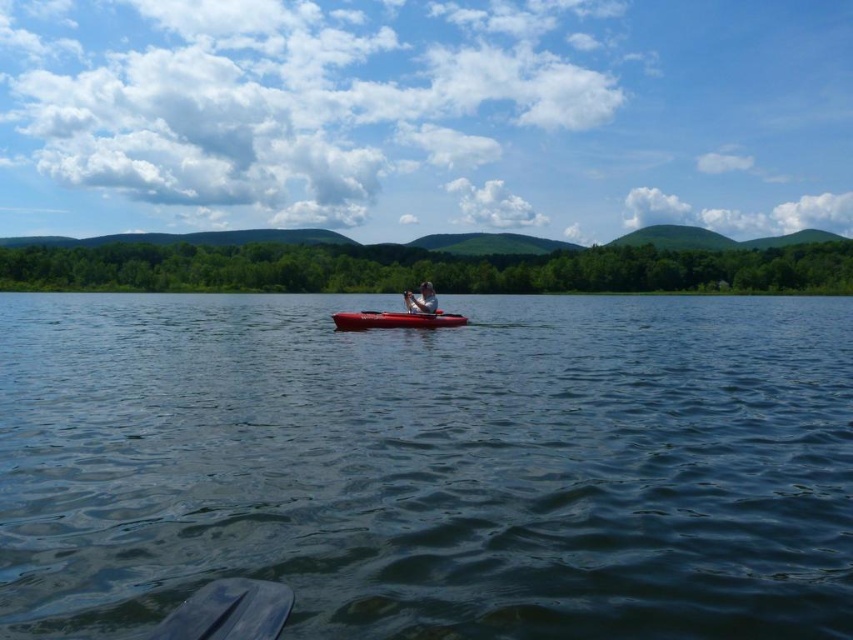
Question: Can you confirm if dark blue water at center is positioned to the right of matte gray kayak at center?

Choices:
 (A) yes
 (B) no

Answer: (B)

Question: From the image, what is the correct spatial relationship of matte red canoe at center in relation to matte gray kayak at center?

Choices:
 (A) below
 (B) above

Answer: (A)

Question: Which of the following is the closest to the observer?

Choices:
 (A) tap(366, 317)
 (B) tap(47, 346)
 (C) tap(447, 324)

Answer: (B)

Question: Which object is farther from the camera taking this photo?

Choices:
 (A) matte red canoe at center
 (B) dark blue water at center
 (C) black plastic paddle at center

Answer: (A)

Question: Estimate the real-world distances between objects in this image. Which object is closer to the dark blue water at center?

Choices:
 (A) matte red canoe at center
 (B) black plastic paddle at center

Answer: (B)

Question: Is dark blue water at center above black plastic paddle at center?

Choices:
 (A) yes
 (B) no

Answer: (B)